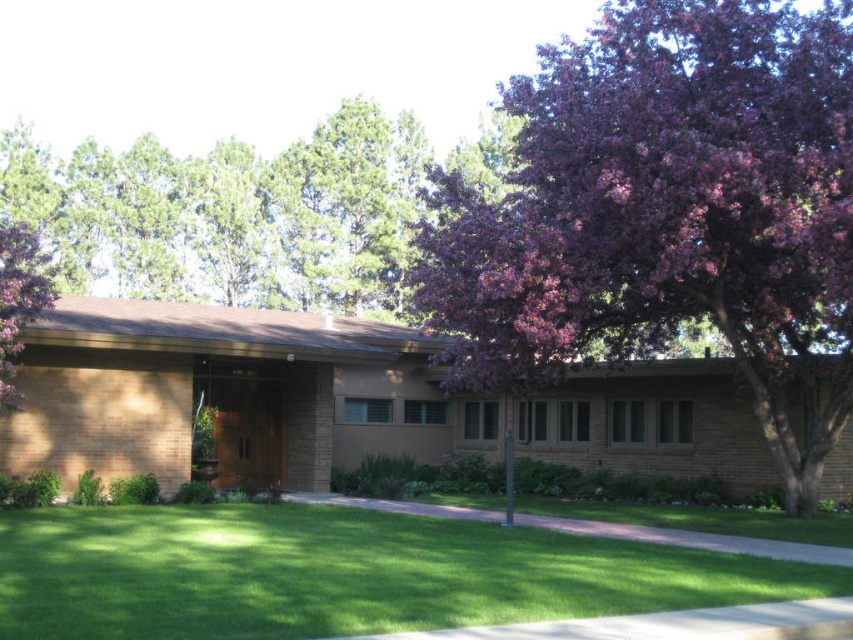
You are a landscape architect designing a garden for this house. You need to place a large statue that requires a space larger than the green grass at lower center. Can the purple leafy tree at upper right accommodate the statue?

The purple leafy tree at upper right is bigger than the green grass at lower center. Therefore, the space under the purple leafy tree at upper right can accommodate the statue since it has a larger area available.

You are a drone operator trying to capture a photo of the green leafy tree at upper center from above. The house is at the bottom of the image. What direction should you fly your drone to get the best shot?

The green leafy tree at upper center is located at point [231,214], so you should fly your drone upwards from the house to capture it from above.